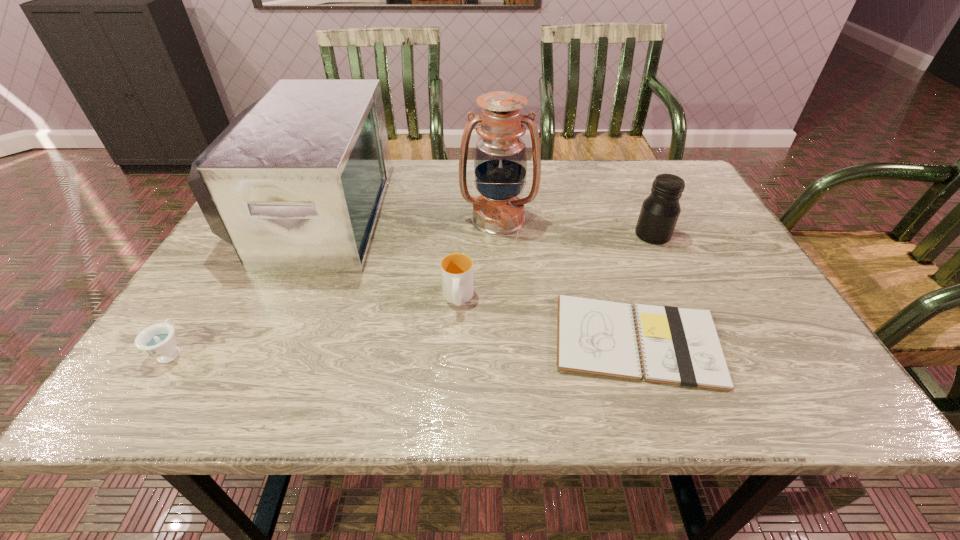
Locate an element on the screen. This screenshot has width=960, height=540. oil lamp is located at coordinates (500, 161).

The height and width of the screenshot is (540, 960). I want to click on the second tallest object, so [295, 183].

Identify the location of jar. This screenshot has width=960, height=540. (660, 211).

Find the location of a particular element. cup is located at coordinates pos(457,268).

Where is `teacup`? teacup is located at coordinates (158, 340).

Locate an element on the screen. notepad is located at coordinates (678, 346).

Locate an element on the screen. The image size is (960, 540). free location located 0.230m on the back of the oil lamp is located at coordinates (495, 161).

In order to click on vacant space situated 0.250m on the front-facing side of the microwave oven in this screenshot , I will do `click(475, 213)`.

Locate an element on the screen. This screenshot has height=540, width=960. free region located 0.220m on the back of the jar is located at coordinates (627, 179).

At what (x,y) coordinates should I click in order to perform the action: click on vacant space located 0.090m with the handle on the side of the cup. Please return your answer as a coordinate pair (x, y). Image resolution: width=960 pixels, height=540 pixels. Looking at the image, I should click on (455, 353).